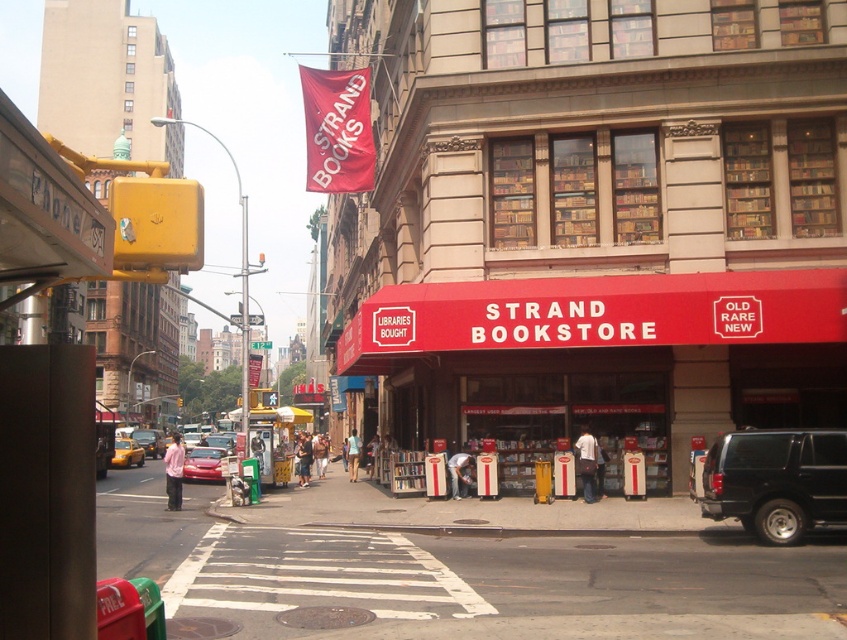
Question: Estimate the real-world distances between objects in this image. Which object is closer to the shiny red sedan at center?

Choices:
 (A) yellow matte taxi cab at left
 (B) matte red awning at center
 (C) metallic red car at center

Answer: (B)

Question: Can you confirm if red matte awning at center is positioned above yellow matte taxi cab at left?

Choices:
 (A) yes
 (B) no

Answer: (A)

Question: Considering the real-world distances, which object is closest to the matte red awning at center?

Choices:
 (A) yellow matte taxi cab at left
 (B) metallic red car at center
 (C) black matte suv at center-right
 (D) red matte awning at center

Answer: (C)

Question: Observing the image, what is the correct spatial positioning of matte red awning at center in reference to yellow matte taxi cab at left?

Choices:
 (A) above
 (B) below

Answer: (A)

Question: Which of the following is the closest to the observer?

Choices:
 (A) black matte suv at center-right
 (B) yellow matte taxi cab at left
 (C) shiny red sedan at center

Answer: (A)

Question: Does shiny red sedan at center appear over metallic red car at center?

Choices:
 (A) no
 (B) yes

Answer: (B)